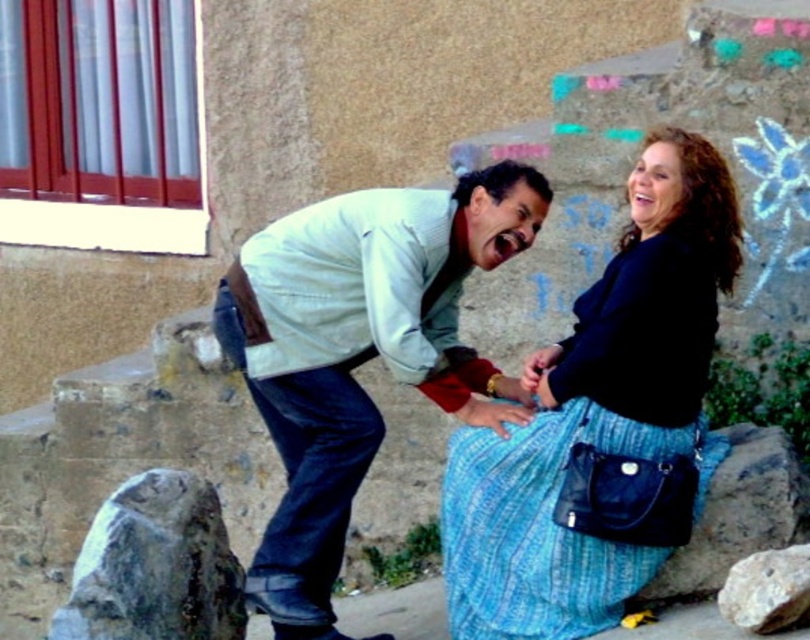
You are a photographer trying to capture the light blue denim jeans at center in the image. Based on their position, which part of the frame should you focus on?

The light blue denim jeans at center are located at point (x=360, y=352), so you should focus on the central area slightly towards the right to capture them properly.

Based on the scene description, which object is taller between the light blue denim jeans at center and the gray rough rock at lower right?

The light blue denim jeans at center is much taller than the gray rough rock at lower right.

You are a photographer trying to capture a detailed shot of both the blue textured skirt at center and the gray rough rock at lower left. Since you can only focus on one object at a time, which object should you choose to ensure the other remains in the background but still visible?

The blue textured skirt at center is larger in size than the gray rough rock at lower left, so focusing on the blue textured skirt at center would keep the smaller gray rough rock at lower left in the background while still being visible.